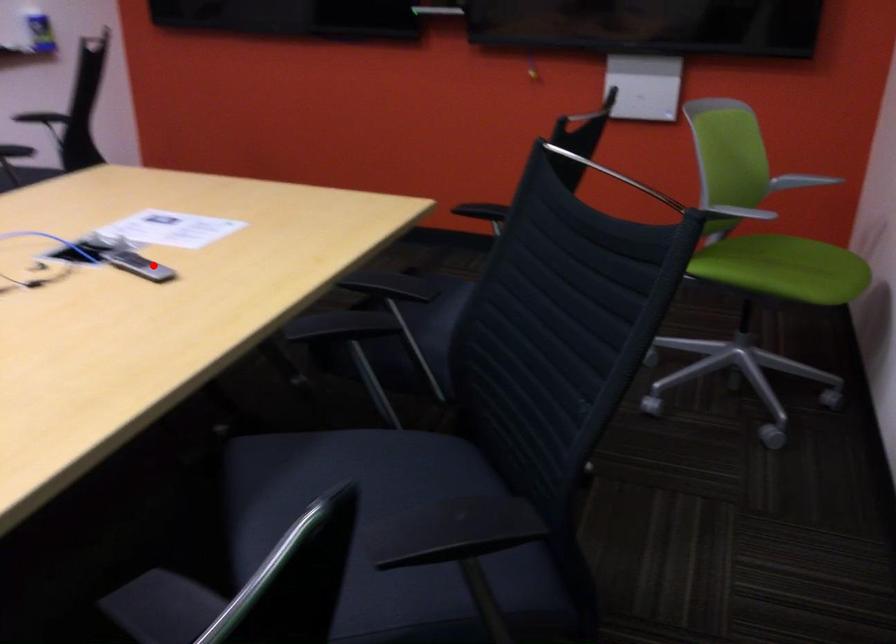
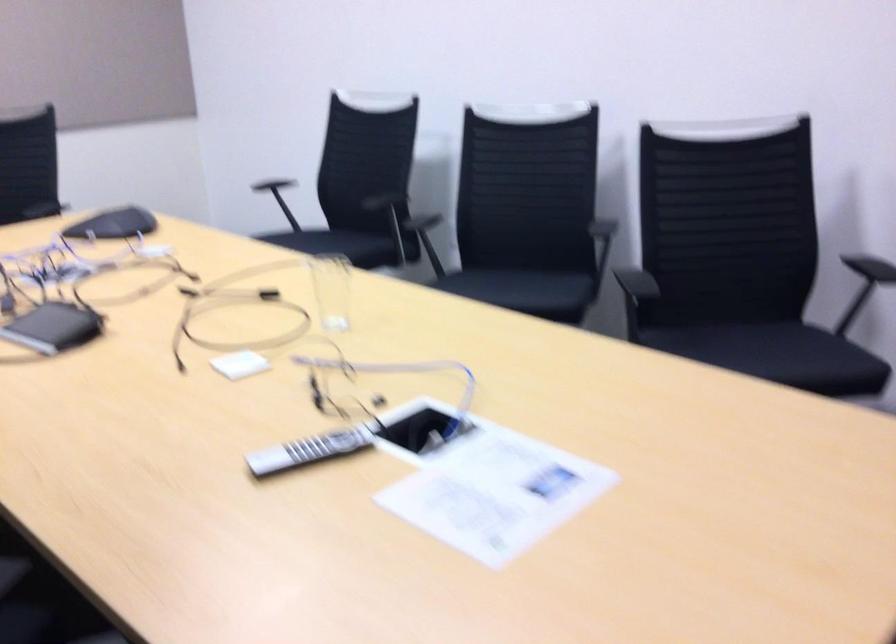
Locate, in the second image, the point that corresponds to the highlighted location in the first image.

(308, 450)